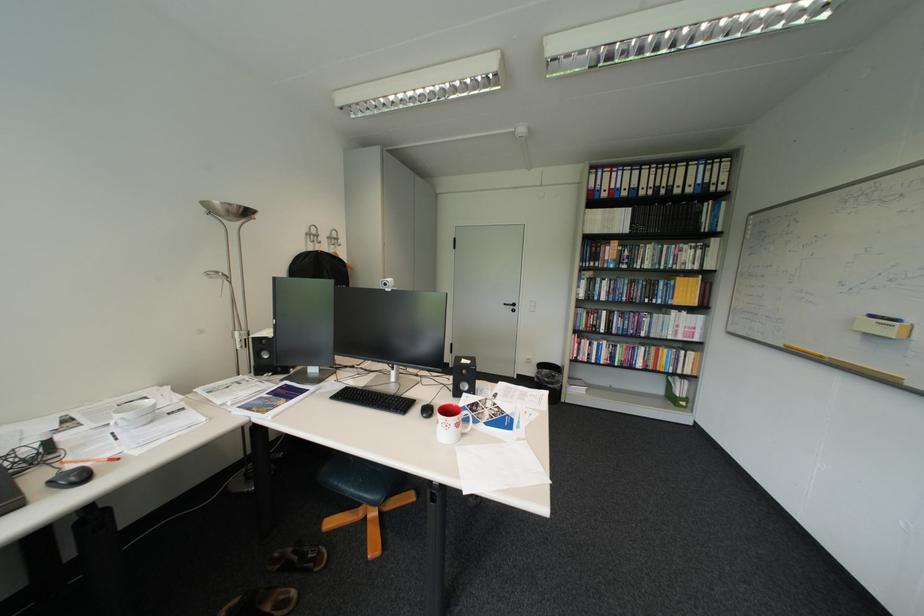
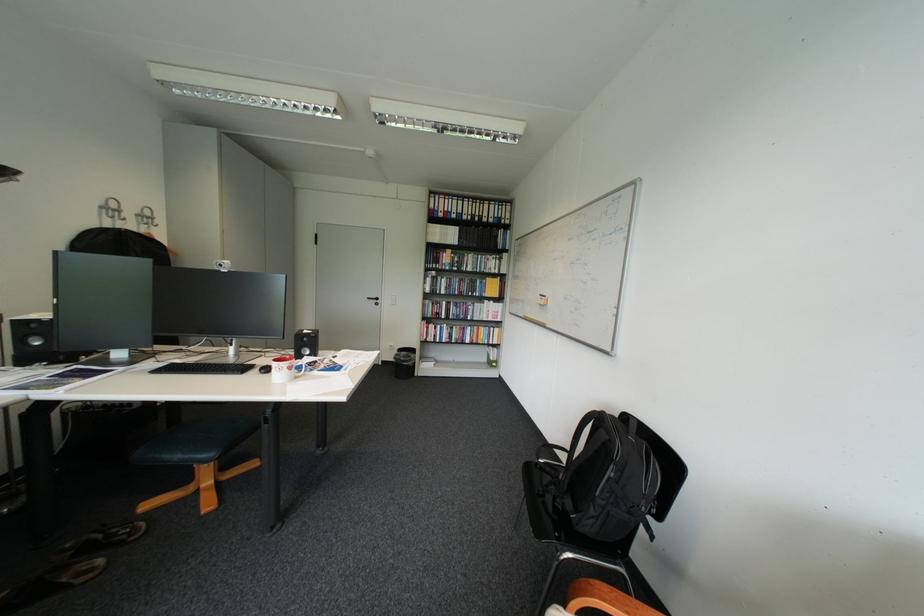
Question: The camera is either moving clockwise (left) or counter-clockwise (right) around the object. The first image is from the beginning of the video and the second image is from the end. Is the camera moving left or right when shooting the video?

Choices:
 (A) Left
 (B) Right

Answer: (A)